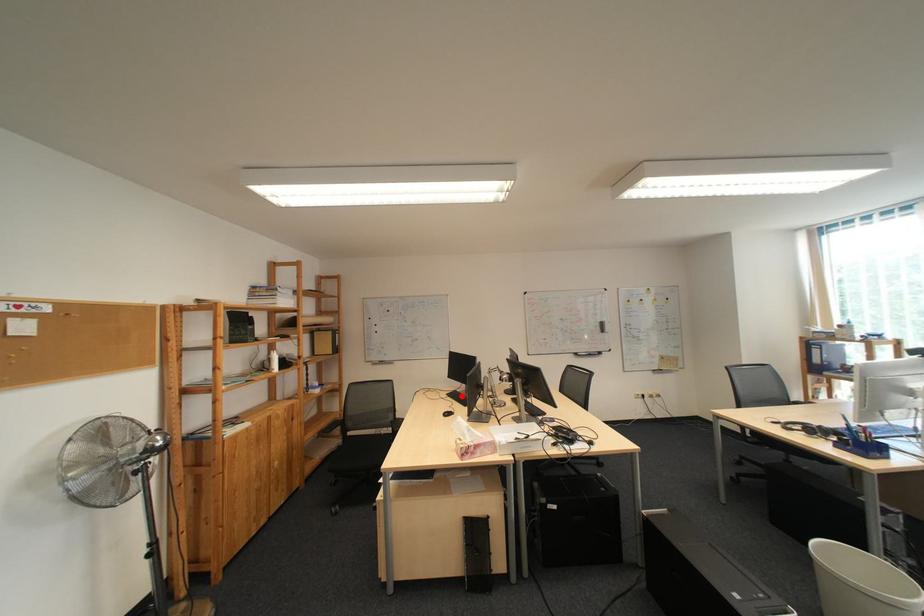
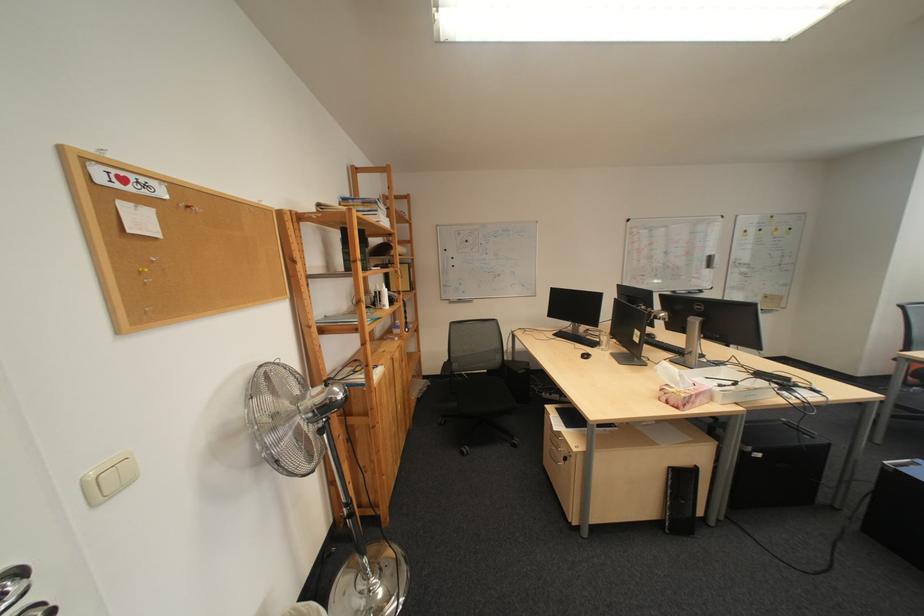
Question: I am providing you with two images of the same scene from different viewpoints. Given a red point in image1, look at the same physical point in image2. Is it:

Choices:
 (A) Closer to the viewpoint
 (B) Farther from the viewpoint

Answer: (A)